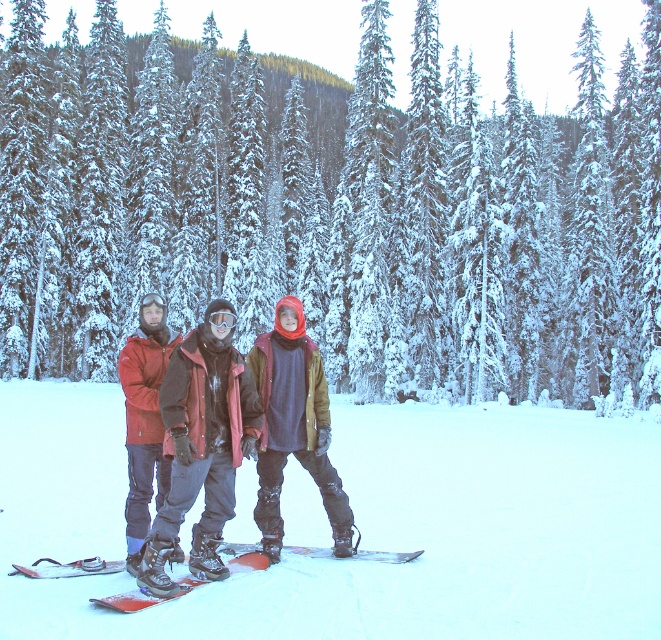
Question: Which point is closer to the camera taking this photo?

Choices:
 (A) (330, 547)
 (B) (46, 410)
 (C) (145, 388)
 (D) (175, 572)

Answer: (C)

Question: Is matte snowboard at center smaller than matte black snowboard at center?

Choices:
 (A) yes
 (B) no

Answer: (B)

Question: Which object is farther from the camera taking this photo?

Choices:
 (A) matte black snowboard at center
 (B) orange matte snowboard at center

Answer: (A)

Question: Among these points, which one is nearest to the camera?

Choices:
 (A) (153, 602)
 (B) (373, 557)
 (C) (264, 580)
 (D) (178, 476)

Answer: (A)

Question: Can you confirm if matte snowboarders at center is thinner than red matte snowboard at center?

Choices:
 (A) no
 (B) yes

Answer: (B)

Question: Is orange matte snowboard at center thinner than red matte snowboard at center?

Choices:
 (A) no
 (B) yes

Answer: (B)